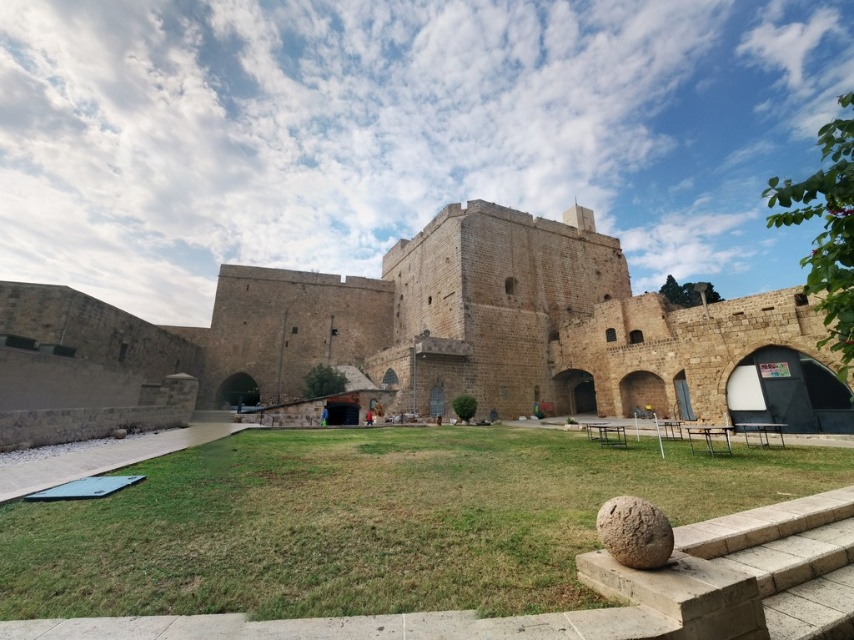
Does point (835, 412) come behind point (612, 513)?

Yes, it is.

Who is shorter, brown stone fort at center or brown rough stone at lower right?

brown rough stone at lower right

Which is behind, point (483, 307) or point (624, 564)?

The point (483, 307) is more distant.

At what (x,y) coordinates should I click in order to perform the action: click on brown stone fort at center. Please return your answer as a coordinate pair (x, y). Looking at the image, I should click on (469, 330).